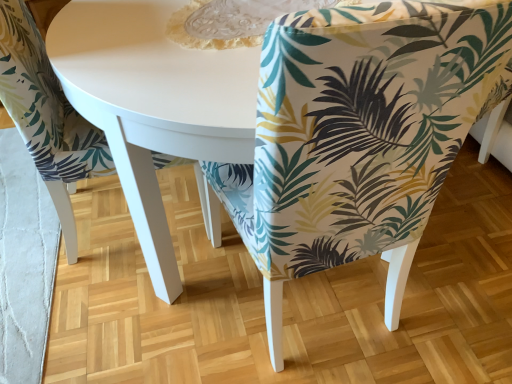
Question: Is printed fabric chair at center, the 1th chair viewed from the right, bigger or smaller than printed fabric chair at center, which is counted as the 1th chair, starting from the left?

Choices:
 (A) big
 (B) small

Answer: (A)

Question: Considering the positions of printed fabric chair at center, marked as the second chair in a left-to-right arrangement, and printed fabric chair at center, the second chair positioned from the right, in the image, is printed fabric chair at center, marked as the second chair in a left-to-right arrangement, taller or shorter than printed fabric chair at center, the second chair positioned from the right,?

Choices:
 (A) short
 (B) tall

Answer: (B)

Question: From the image's perspective, is printed fabric chair at center, marked as the second chair in a left-to-right arrangement, above or below printed fabric chair at center, which is counted as the 1th chair, starting from the left?

Choices:
 (A) below
 (B) above

Answer: (A)

Question: Is printed fabric chair at center, the second chair positioned from the right, wider or thinner than printed fabric chair at center, the 1th chair viewed from the right?

Choices:
 (A) wide
 (B) thin

Answer: (A)

Question: From the image's perspective, is printed fabric chair at center, the second chair positioned from the right, above or below printed fabric chair at center, marked as the second chair in a left-to-right arrangement?

Choices:
 (A) above
 (B) below

Answer: (A)

Question: Do you think printed fabric chair at center, the second chair positioned from the right, is within printed fabric chair at center, the 1th chair viewed from the right, or outside of it?

Choices:
 (A) inside
 (B) outside

Answer: (B)

Question: From a real-world perspective, relative to printed fabric chair at center, the 1th chair viewed from the right, is printed fabric chair at center, the second chair positioned from the right, vertically above or below?

Choices:
 (A) above
 (B) below

Answer: (B)